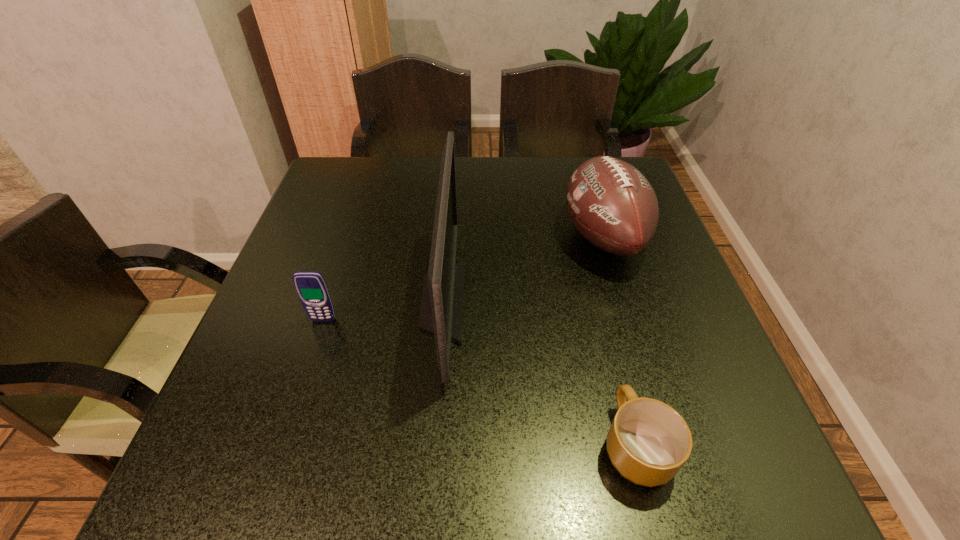
Where is `free space between the shortest object and the tallest object`? The width and height of the screenshot is (960, 540). free space between the shortest object and the tallest object is located at coordinates (540, 373).

Find the location of a particular element. This screenshot has width=960, height=540. empty location between the nearest object and the monitor is located at coordinates (540, 373).

You are a GUI agent. You are given a task and a screenshot of the screen. Output one action in this format:
    pyautogui.click(x=<x>, y=<y>)
    Task: Click on the free space between the nearest object and the second object from left to right
    
    Given the screenshot: What is the action you would take?
    pyautogui.click(x=540, y=373)

Identify the location of vacant area that lies between the second object from left to right and the mug. The image size is (960, 540). (540, 373).

You are a GUI agent. You are given a task and a screenshot of the screen. Output one action in this format:
    pyautogui.click(x=<x>, y=<y>)
    Task: Click on the free area in between the second object from left to right and the mug
    
    Given the screenshot: What is the action you would take?
    [x=540, y=373]

You are a GUI agent. You are given a task and a screenshot of the screen. Output one action in this format:
    pyautogui.click(x=<x>, y=<y>)
    Task: Click on the object that stands as the second closest to the second object from left to right
    
    Given the screenshot: What is the action you would take?
    pyautogui.click(x=648, y=442)

In order to click on object that is the third closest to the mug in this screenshot , I will do `click(311, 287)`.

Where is `vacant space that satisfies the following two spatial constraints: 1. on the screen side of the third object from right to left; 2. on the front-facing side of the cellular telephone`? vacant space that satisfies the following two spatial constraints: 1. on the screen side of the third object from right to left; 2. on the front-facing side of the cellular telephone is located at coordinates (442, 320).

Locate an element on the screen. This screenshot has width=960, height=540. vacant position in the image that satisfies the following two spatial constraints: 1. on the side with the handle of the nearest object; 2. on the left side of the second tallest object is located at coordinates click(x=583, y=237).

The width and height of the screenshot is (960, 540). I want to click on vacant position in the image that satisfies the following two spatial constraints: 1. on the screen side of the second object from left to right; 2. on the front-facing side of the leftmost object, so click(442, 320).